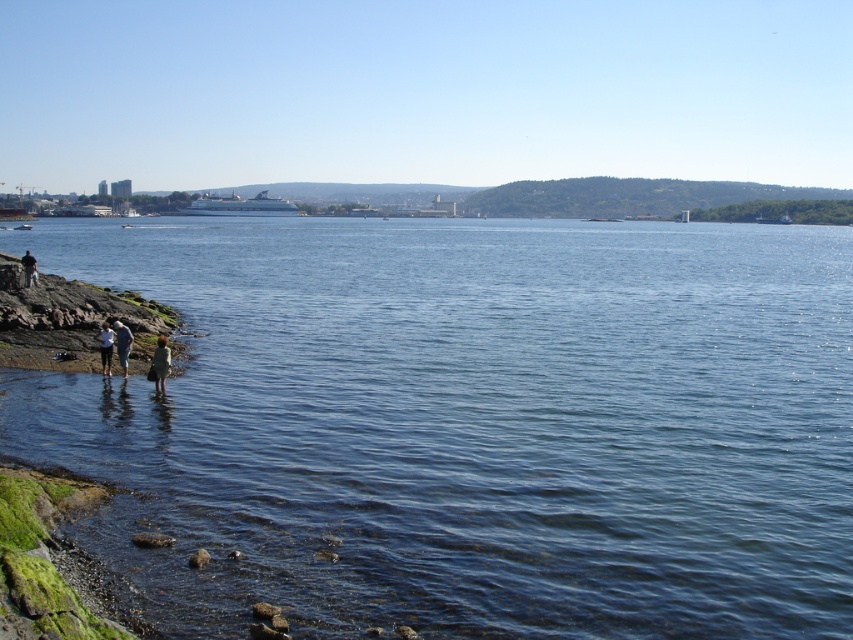
Who is more forward, (102, 342) or (120, 346)?

Positioned in front is point (120, 346).

Describe the element at coordinates (105, 348) in the screenshot. This screenshot has width=853, height=640. I see `white cotton shirt at lower left` at that location.

Identify the location of white cotton shirt at lower left. The width and height of the screenshot is (853, 640). (105, 348).

Does blue water at lower left have a greater width compared to white cotton shirt at lower left?

Yes.

Can you confirm if blue water at lower left is shorter than white cotton shirt at lower left?

In fact, blue water at lower left may be taller than white cotton shirt at lower left.

What do you see at coordinates (469, 424) in the screenshot? I see `blue water at lower left` at bounding box center [469, 424].

Image resolution: width=853 pixels, height=640 pixels. I want to click on blue water at lower left, so click(x=469, y=424).

Which is more to the right, blue water at lower left or green wool coat at lower left?

From the viewer's perspective, blue water at lower left appears more on the right side.

Is point (579, 342) less distant than point (164, 381)?

That is False.

From the picture: Measure the distance between point (436, 376) and camera.

21.07 meters

Locate an element on the screen. blue water at lower left is located at coordinates (469, 424).